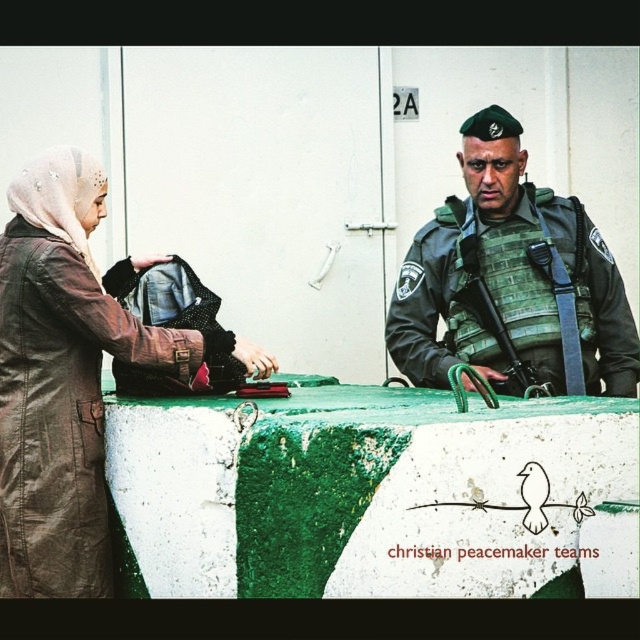
Question: Does brown leather jacket at left appear on the left side of green military uniform at right?

Choices:
 (A) no
 (B) yes

Answer: (B)

Question: Estimate the real-world distances between objects in this image. Which object is farther from the brown leather jacket at left?

Choices:
 (A) green textured rifle at center
 (B) green military uniform at right

Answer: (B)

Question: Can you confirm if green military uniform at right is positioned to the right of green textured rifle at center?

Choices:
 (A) no
 (B) yes

Answer: (B)

Question: Can you confirm if brown leather jacket at left is positioned to the left of green textured rifle at center?

Choices:
 (A) yes
 (B) no

Answer: (A)

Question: Which of the following is the closest to the observer?

Choices:
 (A) (387, 340)
 (B) (472, 248)

Answer: (B)

Question: Which object is the farthest from the green textured rifle at center?

Choices:
 (A) green military uniform at right
 (B) brown leather jacket at left

Answer: (B)